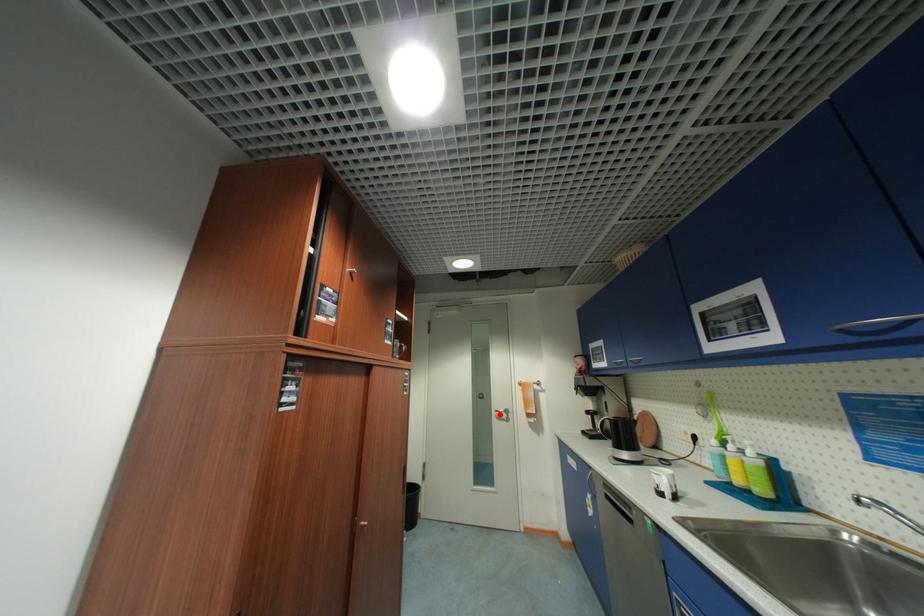
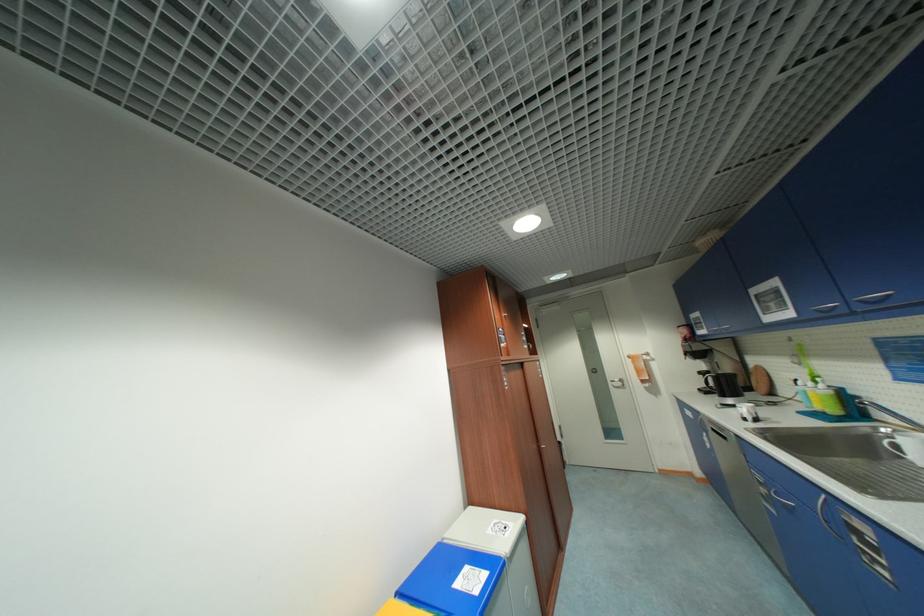
Find the pixel in the second image that matches the highlighted location in the first image.

(615, 384)